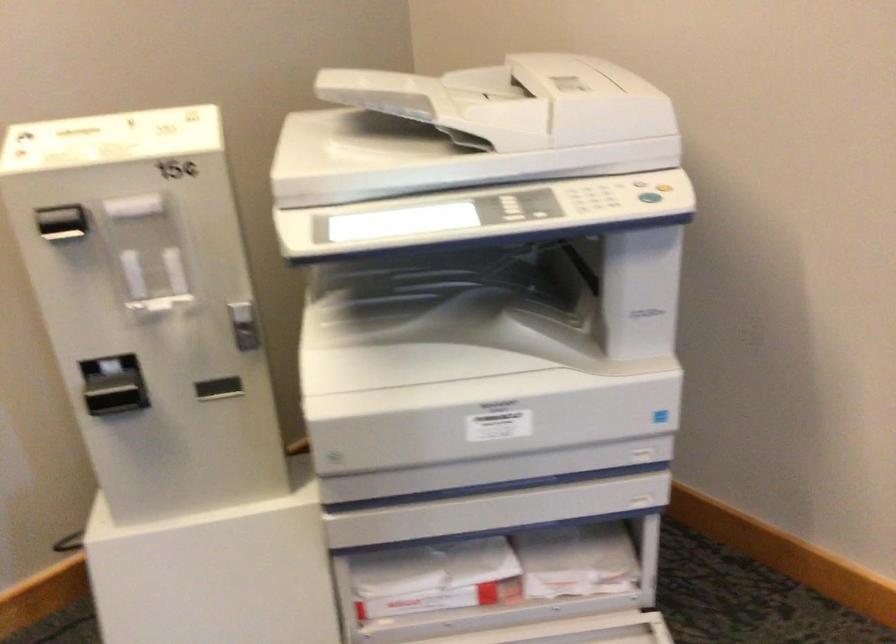
This screenshot has height=644, width=896. Describe the element at coordinates (649, 196) in the screenshot. I see `a green copy button` at that location.